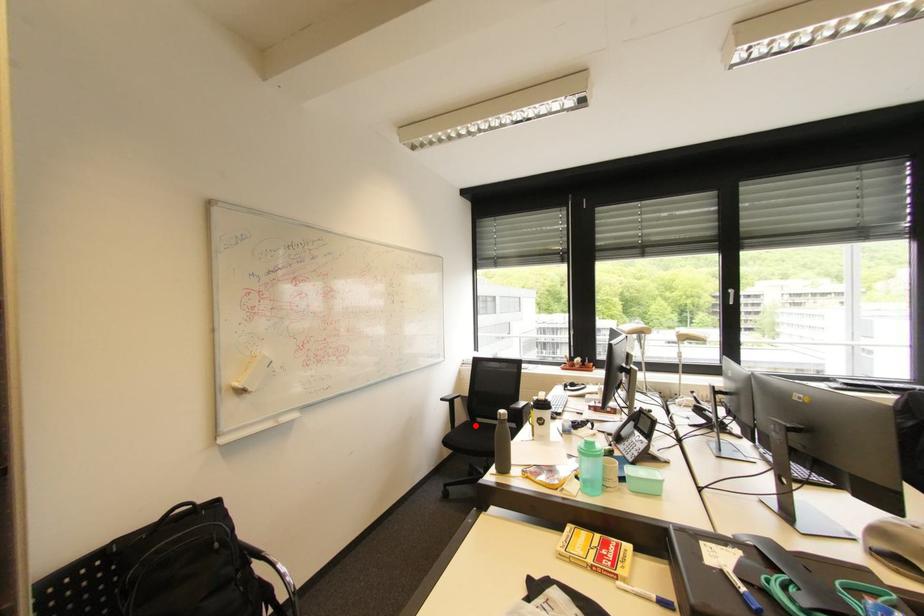
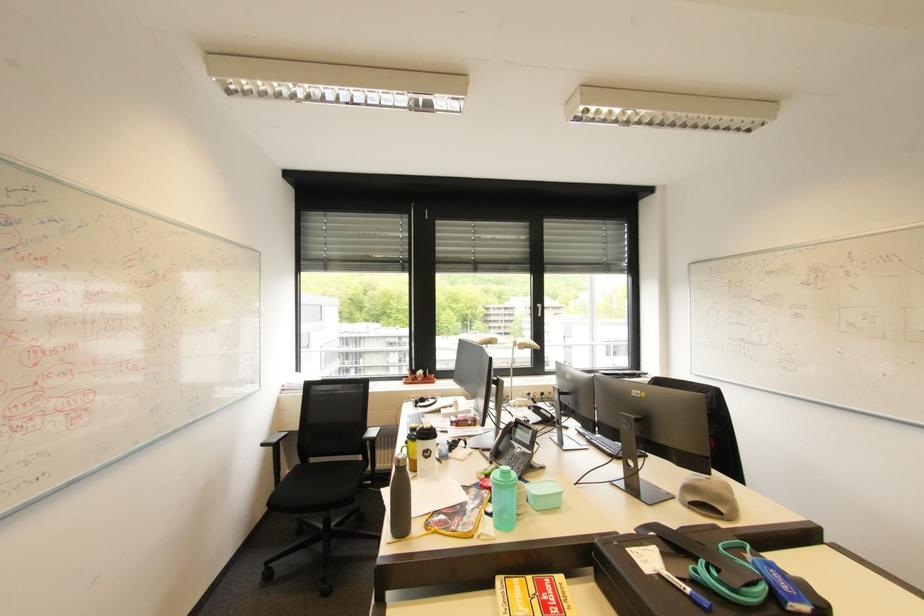
Where in the second image is the point corresponding to the highlighted location from the first image?

(308, 469)